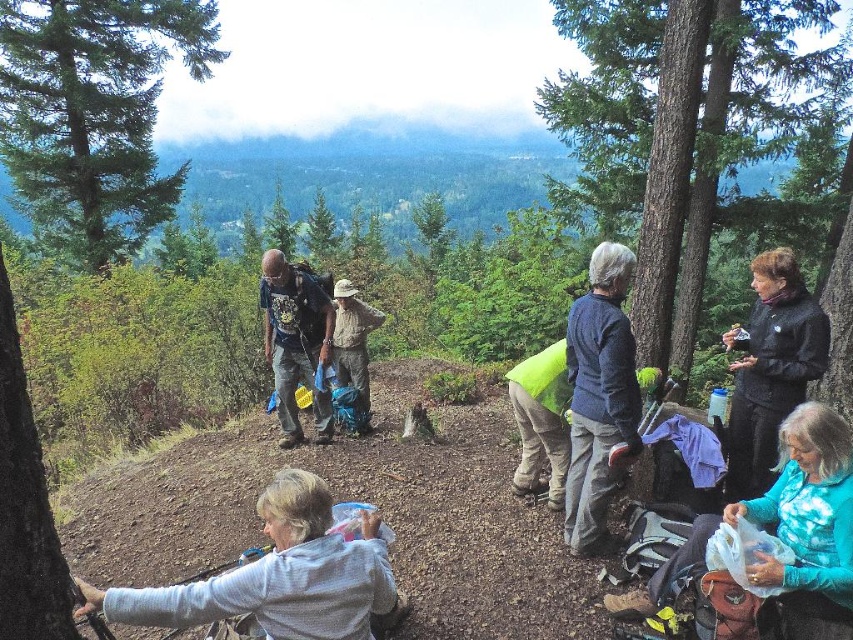
Question: Which object is closer to the camera taking this photo?

Choices:
 (A) camouflage fabric jacket at center
 (B) green coniferous tree at upper left

Answer: (A)

Question: Can you confirm if blue sweater at center is positioned below green fabric backpack at center?

Choices:
 (A) yes
 (B) no

Answer: (B)

Question: Which point is closer to the camera taking this photo?

Choices:
 (A) (97, 205)
 (B) (49, 561)
 (C) (287, 278)

Answer: (B)

Question: Estimate the real-world distances between objects in this image. Which object is closer to the green matte tree trunk at left?

Choices:
 (A) green fabric backpack at center
 (B) gray fleece jacket at lower left
 (C) camouflage fabric jacket at center
 (D) blue sweater at center

Answer: (B)

Question: Can you confirm if teal fabric jacket at lower right is smaller than black softshell jacket at right?

Choices:
 (A) no
 (B) yes

Answer: (A)

Question: Is teal fabric jacket at lower right thinner than camouflage fabric jacket at center?

Choices:
 (A) no
 (B) yes

Answer: (A)